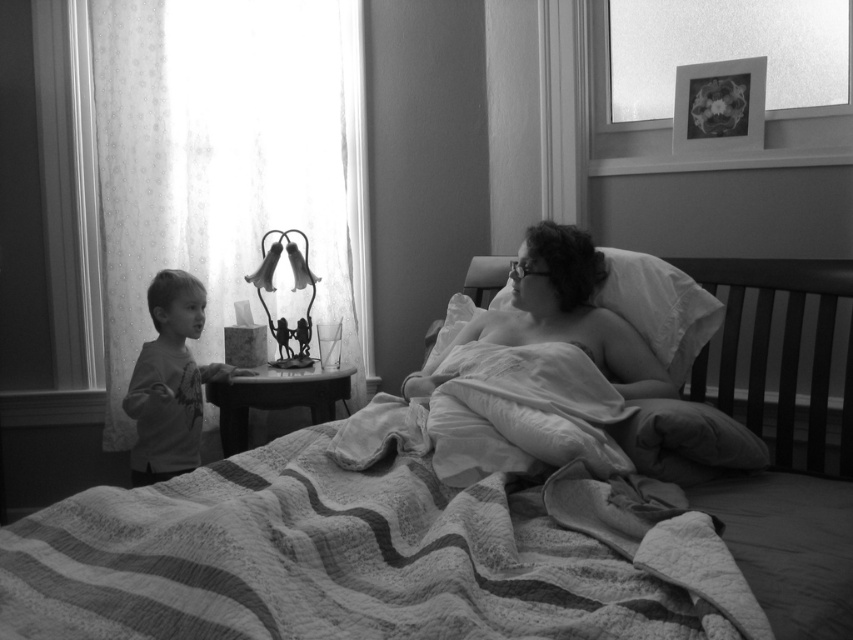
Which is behind, point (160, 461) or point (280, 246)?

The point (280, 246) is more distant.

Which is below, smooth gray shirt at left or metallic wire lamp at center?

smooth gray shirt at left

Between point (164, 392) and point (294, 332), which one is positioned behind?

The point (294, 332) is more distant.

In order to click on smooth gray shirt at left in this screenshot , I will do `click(170, 381)`.

Is point (529, 253) more distant than point (270, 257)?

No.

Is soft fabric pillow at center positioned behind metallic wire lamp at center?

That is False.

Locate an element on the screen. The image size is (853, 640). soft fabric pillow at center is located at coordinates (569, 310).

The height and width of the screenshot is (640, 853). What do you see at coordinates (569, 310) in the screenshot?
I see `soft fabric pillow at center` at bounding box center [569, 310].

Who is positioned more to the left, soft fabric pillow at center or smooth gray shirt at left?

Positioned to the left is smooth gray shirt at left.

Between point (621, 356) and point (154, 285), which one is positioned in front?

Positioned in front is point (621, 356).

Image resolution: width=853 pixels, height=640 pixels. I want to click on soft fabric pillow at center, so click(x=569, y=310).